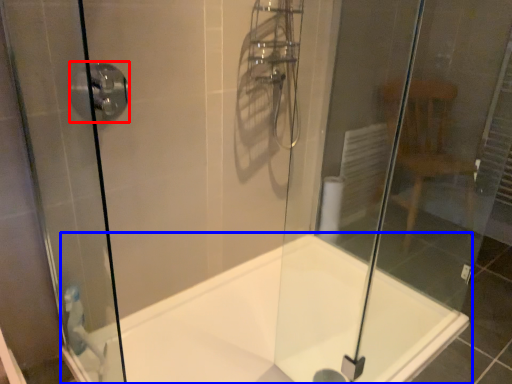
Question: Among these objects, which one is nearest to the camera, shower (highlighted by a red box) or bathtub (highlighted by a blue box)?

Choices:
 (A) shower
 (B) bathtub

Answer: (B)